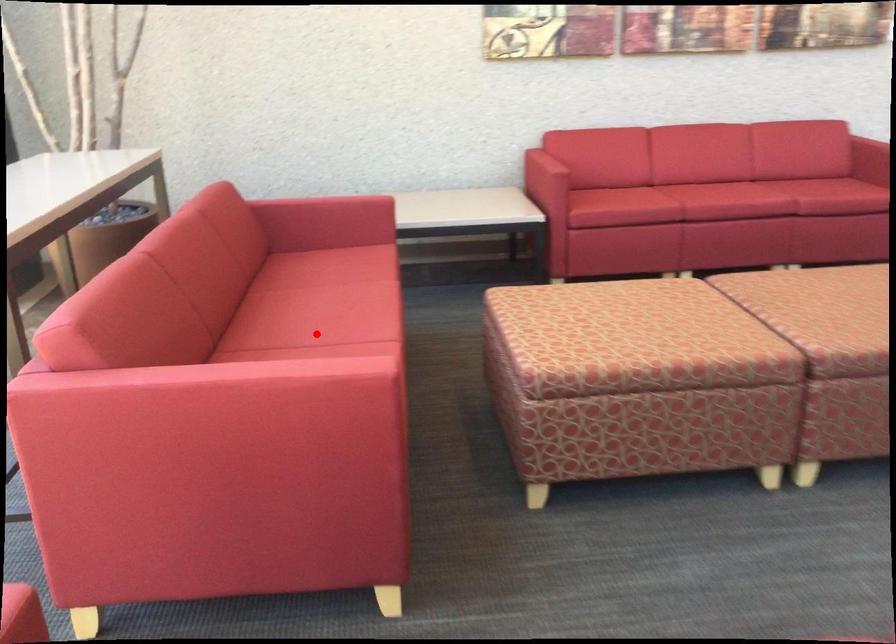
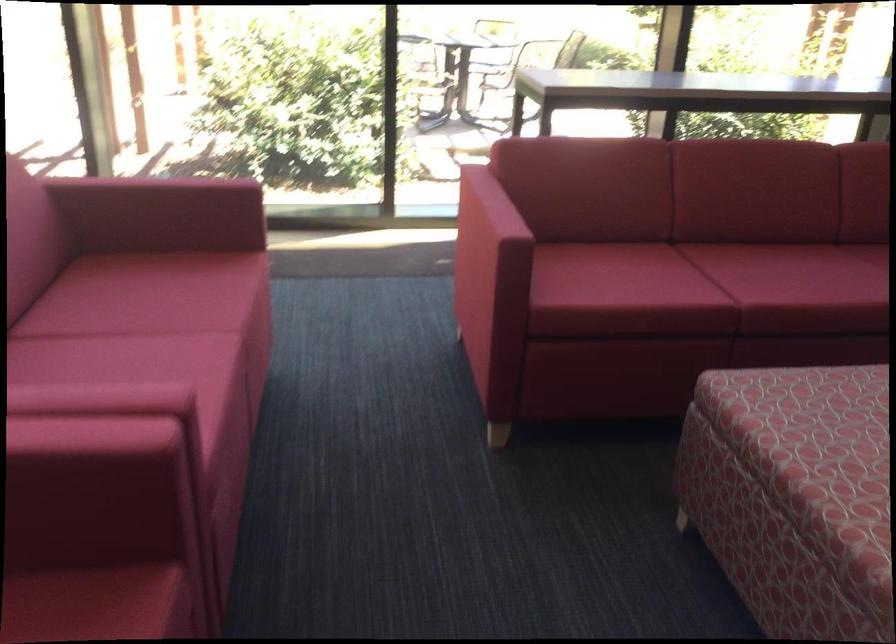
Where in the second image is the point corresponding to the highlighted location from the first image?

(728, 269)